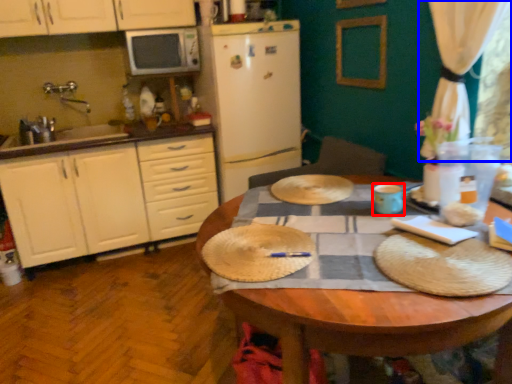
Question: Which of the following is the closest to the observer, coffee cup (highlighted by a red box) or curtain (highlighted by a blue box)?

Choices:
 (A) coffee cup
 (B) curtain

Answer: (B)